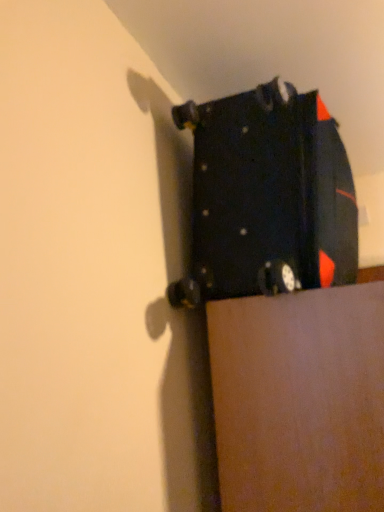
Describe the element at coordinates (267, 197) in the screenshot. I see `matte black suitcase at center` at that location.

Where is `matte black suitcase at center`? This screenshot has height=512, width=384. matte black suitcase at center is located at coordinates (267, 197).

Locate an element on the screen. matte black suitcase at center is located at coordinates (267, 197).